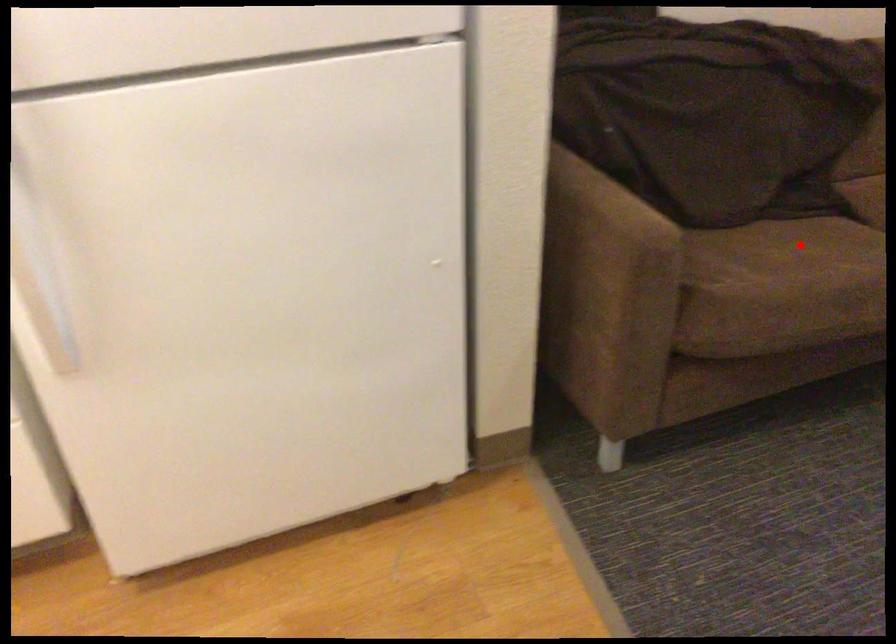
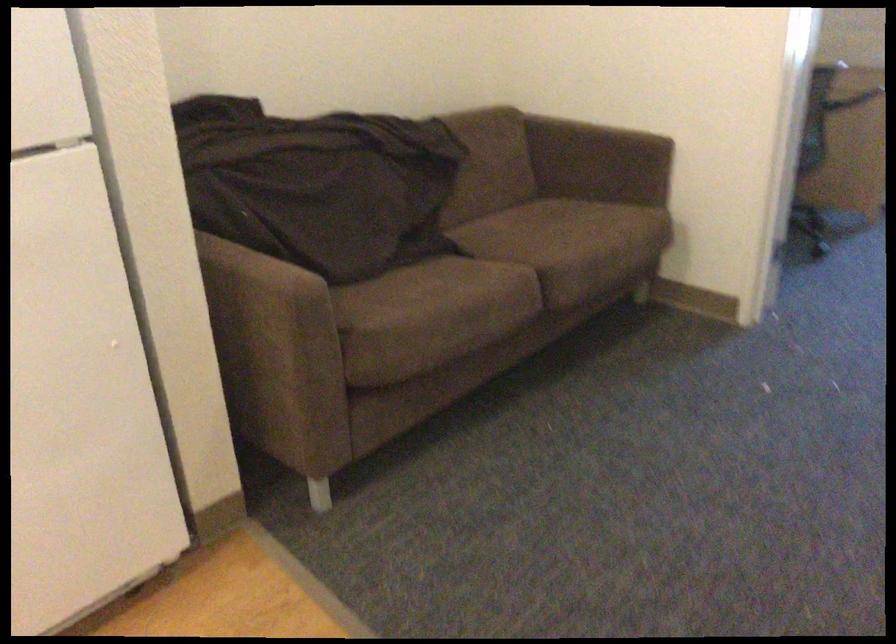
In the second image, find the point that corresponds to the highlighted location in the first image.

(429, 279)